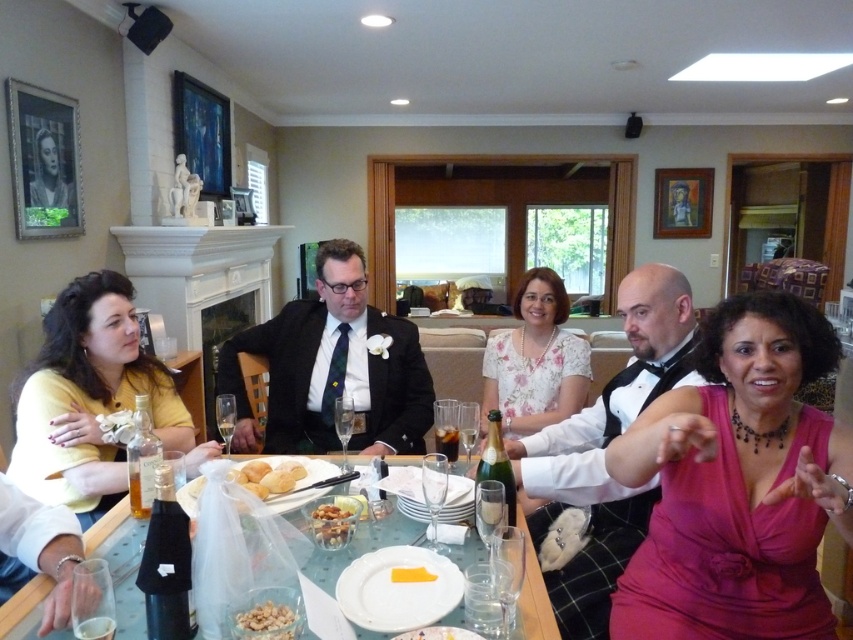
Question: Which of the following is the closest to the observer?

Choices:
 (A) crusty bread at center
 (B) pink satin dress at center
 (C) dark glass at table center
 (D) crumbly white snack at center

Answer: (B)

Question: Which object appears farthest from the camera in this image?

Choices:
 (A) white floral dress at center
 (B) crusty bread at center
 (C) pink satin dress at center

Answer: (A)

Question: Does black satin bow tie at center appear on the left side of clear glass at table center?

Choices:
 (A) no
 (B) yes

Answer: (A)

Question: Which point is farther to the camera?

Choices:
 (A) white floral dress at center
 (B) golden brown bread at center
 (C) dark glass at table center

Answer: (A)

Question: Observing the image, what is the correct spatial positioning of matte black suit at center in reference to clear glass at table center?

Choices:
 (A) below
 (B) above

Answer: (B)

Question: Does black satin bow tie at center have a smaller size compared to white floral dress at center?

Choices:
 (A) no
 (B) yes

Answer: (B)